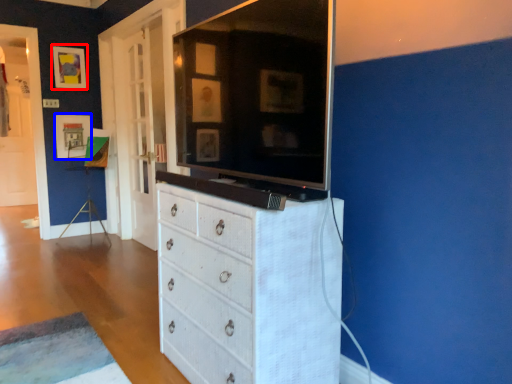
Question: Which object is closer to the camera taking this photo, picture frame (highlighted by a red box) or picture frame (highlighted by a blue box)?

Choices:
 (A) picture frame
 (B) picture frame

Answer: (A)